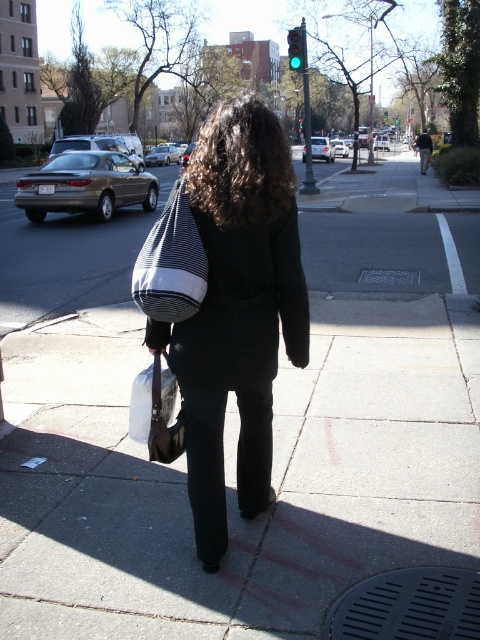
Question: Which object is positioned closest to the striped fabric bag at center?

Choices:
 (A) black fabric bag at center
 (B) green glass traffic light at upper center

Answer: (A)

Question: Which of the following is the closest to the observer?

Choices:
 (A) (300, 64)
 (B) (286, 163)

Answer: (B)

Question: Is striped fabric bag at center to the right of green glass traffic light at upper center from the viewer's perspective?

Choices:
 (A) no
 (B) yes

Answer: (A)

Question: Which object is farther from the camera taking this photo?

Choices:
 (A) black fabric bag at center
 (B) striped fabric bag at center

Answer: (A)

Question: Does striped fabric bag at center appear over green glass traffic light at upper center?

Choices:
 (A) yes
 (B) no

Answer: (B)

Question: Is striped fabric bag at center thinner than green glass traffic light at upper center?

Choices:
 (A) yes
 (B) no

Answer: (A)